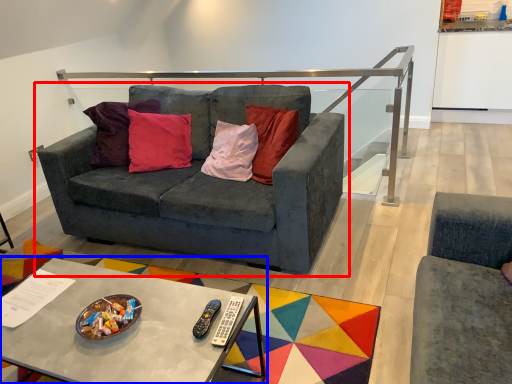
Question: Which object is further to the camera taking this photo, studio couch (highlighted by a red box) or coffee table (highlighted by a blue box)?

Choices:
 (A) studio couch
 (B) coffee table

Answer: (A)